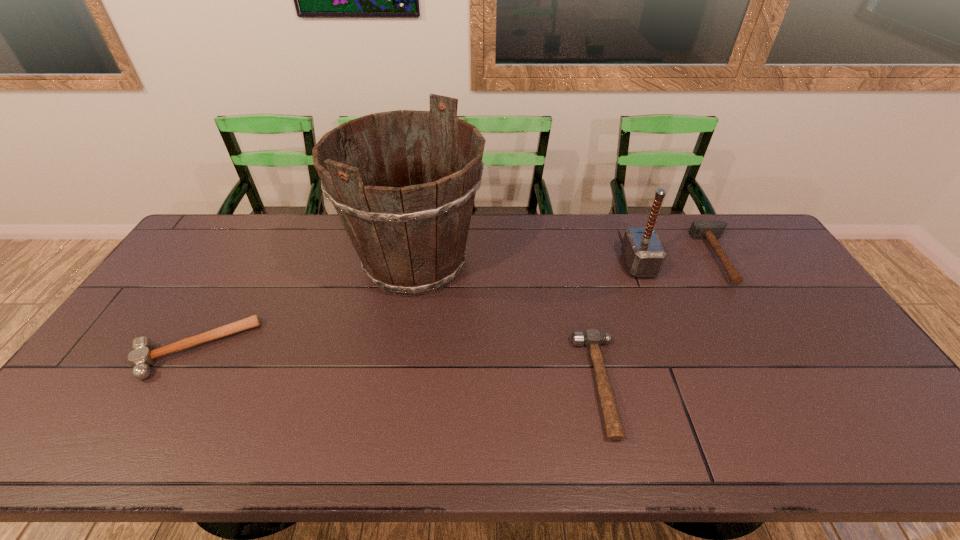
Choose which hammer is the nearest neighbor to the tallest object. Please provide its 2D coordinates. Your answer should be formatted as a tuple, i.e. [(x, y)], where the tuple contains the x and y coordinates of a point satisfying the conditions above.

[(141, 357)]

The image size is (960, 540). Identify the location of vacant point that satisfies the following two spatial constraints: 1. on the front side of the fourth object from left to right; 2. on the striking face of the third object from left to right. (686, 384).

Identify the location of vacant region that satisfies the following two spatial constraints: 1. on the striking surface of the third shortest object; 2. on the front side of the third hammer from left to right. The width and height of the screenshot is (960, 540). (724, 264).

Find the location of `free space that satisfies the following two spatial constraints: 1. on the front side of the second hammer from right to left; 2. on the striking face of the third hammer from right to left`. free space that satisfies the following two spatial constraints: 1. on the front side of the second hammer from right to left; 2. on the striking face of the third hammer from right to left is located at coordinates (686, 384).